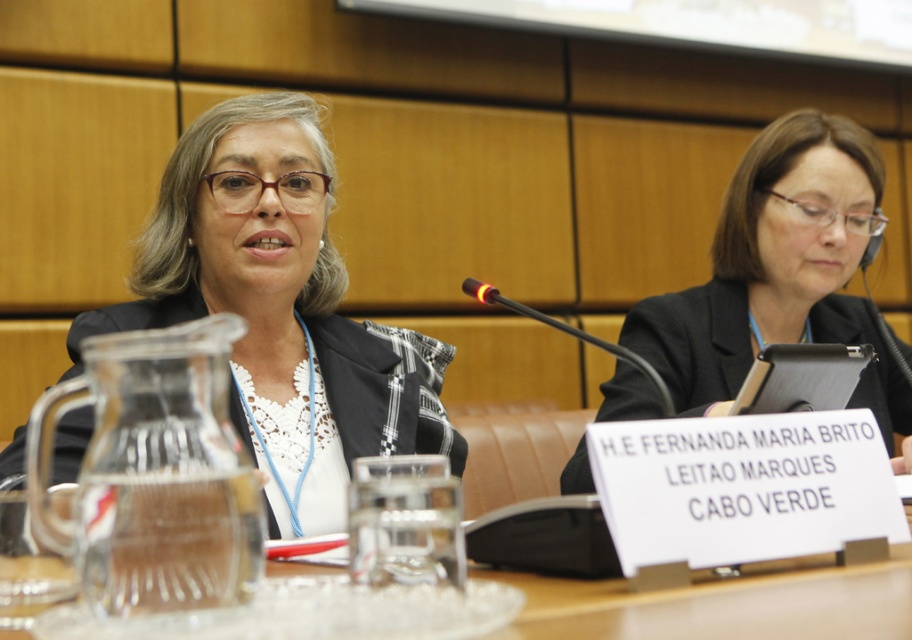
Question: Which point appears farthest from the camera in this image?

Choices:
 (A) (758, 348)
 (B) (503, 300)
 (C) (121, 362)

Answer: (A)

Question: Is clear glass water at center behind black plastic microphone at center?

Choices:
 (A) no
 (B) yes

Answer: (A)

Question: Which object is positioned farthest from the matte black jacket at center?

Choices:
 (A) clear glass water at center
 (B) black matte tablet at center
 (C) black plastic microphone at center

Answer: (A)

Question: In this image, where is clear glass pitcher at left located relative to black matte tablet at center?

Choices:
 (A) above
 (B) below

Answer: (B)

Question: In this image, where is clear glass water at center located relative to black plastic microphone at center?

Choices:
 (A) above
 (B) below

Answer: (B)

Question: Among these points, which one is farthest from the camera?

Choices:
 (A) [x=855, y=580]
 (B) [x=144, y=493]
 (C) [x=521, y=308]
 (D) [x=757, y=136]

Answer: (D)